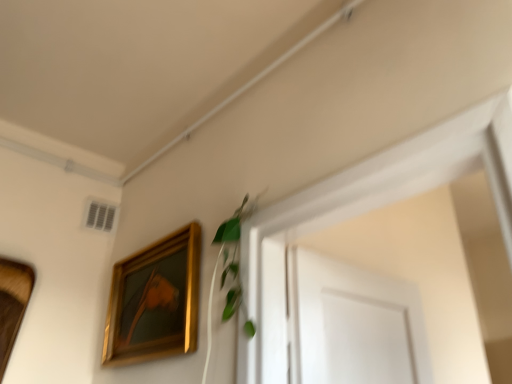
Looking at this image, what is the approximate width of green leafy plant at upper center?

It is 6.43 centimeters.

What are the coordinates of `gold/glossy picture frame at upper left, the 1th picture frame when ordered from right to left` in the screenshot? It's located at (154, 301).

From the image's perspective, does green leafy plant at upper center appear higher than gold/glossy picture frame at upper left, the 1th picture frame when ordered from right to left?

Correct, green leafy plant at upper center appears higher than gold/glossy picture frame at upper left, the 1th picture frame when ordered from right to left, in the image.

Is green leafy plant at upper center turned away from gold/glossy picture frame at upper left, the 1th picture frame when ordered from right to left?

No, green leafy plant at upper center is not facing the opposite direction of gold/glossy picture frame at upper left, the 1th picture frame when ordered from right to left.

Which is more to the right, green leafy plant at upper center or gold/glossy picture frame at upper left, the 2th picture frame positioned from the left?

Positioned to the right is green leafy plant at upper center.

Based on the photo, which object is thinner, green leafy plant at upper center or gold/glossy picture frame at upper left, the 1th picture frame when ordered from right to left?

With smaller width is green leafy plant at upper center.

Is green leafy plant at upper center not within wooden picture frame at left, arranged as the 2th picture frame when viewed from the right?

green leafy plant at upper center is positioned outside wooden picture frame at left, arranged as the 2th picture frame when viewed from the right.

Who is shorter, green leafy plant at upper center or wooden picture frame at left, the first picture frame viewed from the left?

Standing shorter between the two is green leafy plant at upper center.

Measure the distance between green leafy plant at upper center and wooden picture frame at left, arranged as the 2th picture frame when viewed from the right.

green leafy plant at upper center and wooden picture frame at left, arranged as the 2th picture frame when viewed from the right, are 38.20 inches apart from each other.

From a real-world perspective, is green leafy plant at upper center positioned above or below wooden picture frame at left, the first picture frame viewed from the left?

Clearly, from a real-world perspective, green leafy plant at upper center is above wooden picture frame at left, the first picture frame viewed from the left.

Does point (2, 366) come behind point (123, 348)?

That is False.

Could gold/glossy picture frame at upper left, the 2th picture frame positioned from the left, be considered to be inside wooden picture frame at left, arranged as the 2th picture frame when viewed from the right?

Actually, gold/glossy picture frame at upper left, the 2th picture frame positioned from the left, is outside wooden picture frame at left, arranged as the 2th picture frame when viewed from the right.

Can you tell me how much wooden picture frame at left, the first picture frame viewed from the left, and gold/glossy picture frame at upper left, the 2th picture frame positioned from the left, differ in facing direction?

The facing directions of wooden picture frame at left, the first picture frame viewed from the left, and gold/glossy picture frame at upper left, the 2th picture frame positioned from the left, are 88.6 degrees apart.

Is wooden picture frame at left, arranged as the 2th picture frame when viewed from the right, far away from gold/glossy picture frame at upper left, the 1th picture frame when ordered from right to left?

No, wooden picture frame at left, arranged as the 2th picture frame when viewed from the right, is not far away from gold/glossy picture frame at upper left, the 1th picture frame when ordered from right to left.

Considering the points (114, 334) and (240, 211), which point is in front, point (114, 334) or point (240, 211)?

The point (240, 211) is closer to the camera.

Is gold/glossy picture frame at upper left, the 2th picture frame positioned from the left, facing away from green leafy plant at upper center?

gold/glossy picture frame at upper left, the 2th picture frame positioned from the left, does not have its back to green leafy plant at upper center.

Does gold/glossy picture frame at upper left, the 2th picture frame positioned from the left, have a lesser width compared to green leafy plant at upper center?

Incorrect, the width of gold/glossy picture frame at upper left, the 2th picture frame positioned from the left, is not less than that of green leafy plant at upper center.

Considering the sizes of objects gold/glossy picture frame at upper left, the 1th picture frame when ordered from right to left, and green leafy plant at upper center in the image provided, who is bigger, gold/glossy picture frame at upper left, the 1th picture frame when ordered from right to left, or green leafy plant at upper center?

With larger size is gold/glossy picture frame at upper left, the 1th picture frame when ordered from right to left.

How far apart are wooden picture frame at left, the first picture frame viewed from the left, and green leafy plant at upper center?

wooden picture frame at left, the first picture frame viewed from the left, is 38.20 inches from green leafy plant at upper center.

Looking at this image, does wooden picture frame at left, the first picture frame viewed from the left, have a smaller size compared to green leafy plant at upper center?

Incorrect, wooden picture frame at left, the first picture frame viewed from the left, is not smaller in size than green leafy plant at upper center.

Between point (21, 297) and point (225, 259), which one is positioned in front?

Point (225, 259)

Is gold/glossy picture frame at upper left, the 2th picture frame positioned from the left, bigger or smaller than wooden picture frame at left, the first picture frame viewed from the left?

gold/glossy picture frame at upper left, the 2th picture frame positioned from the left, is bigger than wooden picture frame at left, the first picture frame viewed from the left.

Which is more to the right, gold/glossy picture frame at upper left, the 1th picture frame when ordered from right to left, or wooden picture frame at left, the first picture frame viewed from the left?

From the viewer's perspective, gold/glossy picture frame at upper left, the 1th picture frame when ordered from right to left, appears more on the right side.

Where is `picture frame above the wooden picture frame at left, the first picture frame viewed from the left (from the image's perspective)`? picture frame above the wooden picture frame at left, the first picture frame viewed from the left (from the image's perspective) is located at coordinates (154, 301).

Does point (170, 310) lie in front of point (14, 314)?

That is True.

I want to click on plant to the right of gold/glossy picture frame at upper left, the 2th picture frame positioned from the left, so click(233, 254).

The width and height of the screenshot is (512, 384). I want to click on the 2nd picture frame directly beneath the green leafy plant at upper center (from a real-world perspective), so click(x=12, y=303).

Considering their positions, is gold/glossy picture frame at upper left, the 1th picture frame when ordered from right to left, positioned further to green leafy plant at upper center than wooden picture frame at left, the first picture frame viewed from the left?

wooden picture frame at left, the first picture frame viewed from the left, lies further to green leafy plant at upper center than the other object.

Considering their positions, is gold/glossy picture frame at upper left, the 2th picture frame positioned from the left, positioned closer to wooden picture frame at left, arranged as the 2th picture frame when viewed from the right, than green leafy plant at upper center?

Among the two, gold/glossy picture frame at upper left, the 2th picture frame positioned from the left, is located nearer to wooden picture frame at left, arranged as the 2th picture frame when viewed from the right.

When comparing their distances from gold/glossy picture frame at upper left, the 1th picture frame when ordered from right to left, does green leafy plant at upper center or wooden picture frame at left, the first picture frame viewed from the left, seem further?

wooden picture frame at left, the first picture frame viewed from the left, is positioned further to the anchor gold/glossy picture frame at upper left, the 1th picture frame when ordered from right to left.

Considering their positions, is wooden picture frame at left, arranged as the 2th picture frame when viewed from the right, positioned closer to green leafy plant at upper center than gold/glossy picture frame at upper left, the 1th picture frame when ordered from right to left?

The object closer to green leafy plant at upper center is gold/glossy picture frame at upper left, the 1th picture frame when ordered from right to left.

Which object lies further to the anchor point gold/glossy picture frame at upper left, the 2th picture frame positioned from the left, wooden picture frame at left, the first picture frame viewed from the left, or green leafy plant at upper center?

wooden picture frame at left, the first picture frame viewed from the left, is further to gold/glossy picture frame at upper left, the 2th picture frame positioned from the left.

Considering their positions, is green leafy plant at upper center positioned closer to wooden picture frame at left, the first picture frame viewed from the left, than gold/glossy picture frame at upper left, the 1th picture frame when ordered from right to left?

gold/glossy picture frame at upper left, the 1th picture frame when ordered from right to left, is closer to wooden picture frame at left, the first picture frame viewed from the left.

Identify the location of picture frame between wooden picture frame at left, the first picture frame viewed from the left, and green leafy plant at upper center from left to right. This screenshot has height=384, width=512. (154, 301).